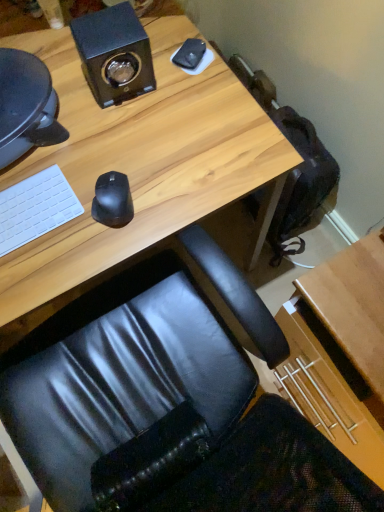
This screenshot has width=384, height=512. I want to click on free space between black matte mouse at center and black matte speaker at upper left, so [119, 140].